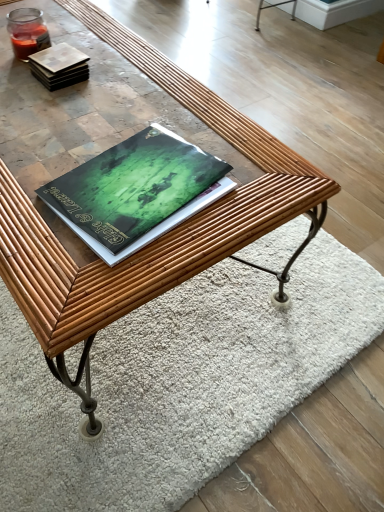
Describe the element at coordinates (136, 191) in the screenshot. The width and height of the screenshot is (384, 512). I see `green matte book at center, which is counted as the first book, starting from the front` at that location.

Where is `matte brown tile at upper left, arranged as the 1th book when viewed from the back`? This screenshot has height=512, width=384. matte brown tile at upper left, arranged as the 1th book when viewed from the back is located at coordinates (59, 66).

Where is `green matte book at center, which is counted as the first book, starting from the front`? The height and width of the screenshot is (512, 384). green matte book at center, which is counted as the first book, starting from the front is located at coordinates (136, 191).

Is point (252, 387) positioned before point (65, 77)?

No, it is behind (65, 77).

Which object is positioned more to the left, rug at center or matte brown tile at upper left, which is the 2th book in bottom-to-top order?

From the viewer's perspective, matte brown tile at upper left, which is the 2th book in bottom-to-top order, appears more on the left side.

From the image's perspective, relative to matte brown tile at upper left, arranged as the 1th book when viewed from the back, is rug at center above or below?

Based on their image positions, rug at center is located beneath matte brown tile at upper left, arranged as the 1th book when viewed from the back.

From a real-world perspective, which object rests below the other?

rug at center is physically lower.

From the picture: Which object is positioned more to the right, matte brown tile at upper left, arranged as the 1th book when viewed from the back, or green matte book at center, which is counted as the first book, starting from the front?

Positioned to the right is green matte book at center, which is counted as the first book, starting from the front.

Locate an element on the screen. book on the left of green matte book at center, acting as the second book starting from the back is located at coordinates (59, 66).

Is point (37, 52) closer to viewer compared to point (149, 197)?

No, it is behind (149, 197).

Is rug at center at the left side of green matte book at center, which is counted as the first book, starting from the front?

No.

From the image's perspective, starting from the rug at center, which book is the 1st one above? Please provide its 2D coordinates.

[(136, 191)]

Does rug at center have a larger size compared to green matte book at center, acting as the second book starting from the back?

Yes.

Does point (288, 405) appear closer or farther from the camera than point (119, 202)?

Clearly, point (288, 405) is more distant from the camera than point (119, 202).

Which is closer, (90, 169) or (336, 273)?

Point (90, 169) appears to be closer to the viewer than point (336, 273).

Is green matte book at center, acting as the second book starting from the back, in front of or behind rug at center in the image?

green matte book at center, acting as the second book starting from the back, is positioned closer to the viewer than rug at center.

Can you confirm if green matte book at center, acting as the second book starting from the back, is taller than rug at center?

Incorrect, the height of green matte book at center, acting as the second book starting from the back, is not larger of that of rug at center.

Based on the photo, between green matte book at center, acting as the second book starting from the back, and rug at center, which one has larger size?

rug at center is bigger.

Is matte brown tile at upper left, arranged as the 2th book when viewed from the front, positioned far away from rug at center?

They are positioned close to each other.

From the image's perspective, who appears lower, matte brown tile at upper left, arranged as the 2th book when viewed from the front, or rug at center?

rug at center.

Can you confirm if matte brown tile at upper left, arranged as the 1th book when viewed from the back, is positioned to the right of rug at center?

Incorrect, matte brown tile at upper left, arranged as the 1th book when viewed from the back, is not on the right side of rug at center.

From the image's perspective, is green matte book at center, the 2th book viewed from the top, positioned above or below matte brown tile at upper left, arranged as the 1th book when viewed from the back?

Clearly, from the image's perspective, green matte book at center, the 2th book viewed from the top, is below matte brown tile at upper left, arranged as the 1th book when viewed from the back.

Relative to matte brown tile at upper left, marked as the first book in a top-to-bottom arrangement, is green matte book at center, acting as the second book starting from the back, in front or behind?

green matte book at center, acting as the second book starting from the back, is positioned closer to the viewer than matte brown tile at upper left, marked as the first book in a top-to-bottom arrangement.

Would you say green matte book at center, the 1th book ordered from the bottom, is a long distance from matte brown tile at upper left, arranged as the 1th book when viewed from the back?

green matte book at center, the 1th book ordered from the bottom, is near matte brown tile at upper left, arranged as the 1th book when viewed from the back, not far away.

In order to click on book behind the rug at center in this screenshot , I will do `click(59, 66)`.

Identify the location of book on the right of matte brown tile at upper left, marked as the first book in a top-to-bottom arrangement. (136, 191).

Looking at the image, which one is located closer to green matte book at center, the 2th book viewed from the top, rug at center or matte brown tile at upper left, which is the 2th book in bottom-to-top order?

Based on the image, matte brown tile at upper left, which is the 2th book in bottom-to-top order, appears to be nearer to green matte book at center, the 2th book viewed from the top.

Based on their spatial positions, is matte brown tile at upper left, arranged as the 2th book when viewed from the front, or rug at center closer to green matte book at center, the 2th book viewed from the top?

matte brown tile at upper left, arranged as the 2th book when viewed from the front, is closer to green matte book at center, the 2th book viewed from the top.

When comparing their distances from matte brown tile at upper left, marked as the first book in a top-to-bottom arrangement, does rug at center or green matte book at center, acting as the second book starting from the back, seem closer?

Among the two, green matte book at center, acting as the second book starting from the back, is located nearer to matte brown tile at upper left, marked as the first book in a top-to-bottom arrangement.

Considering their positions, is green matte book at center, acting as the second book starting from the back, positioned further to rug at center than matte brown tile at upper left, which is the 2th book in bottom-to-top order?

matte brown tile at upper left, which is the 2th book in bottom-to-top order, is further to rug at center.

Looking at the image, which one is located further to rug at center, matte brown tile at upper left, arranged as the 1th book when viewed from the back, or green matte book at center, the 1th book ordered from the bottom?

Based on the image, matte brown tile at upper left, arranged as the 1th book when viewed from the back, appears to be further to rug at center.

Considering their positions, is green matte book at center, the 1th book ordered from the bottom, positioned closer to matte brown tile at upper left, arranged as the 2th book when viewed from the front, than rug at center?

Among the two, green matte book at center, the 1th book ordered from the bottom, is located nearer to matte brown tile at upper left, arranged as the 2th book when viewed from the front.

At what (x,y) coordinates should I click in order to perform the action: click on book between matte brown tile at upper left, which is the 2th book in bottom-to-top order, and rug at center from top to bottom. Please return your answer as a coordinate pair (x, y). The height and width of the screenshot is (512, 384). Looking at the image, I should click on (136, 191).